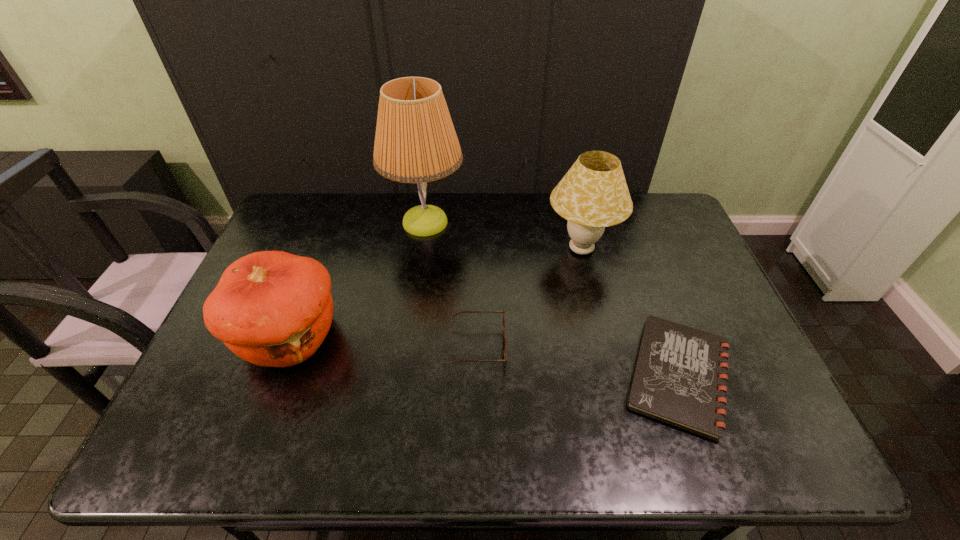
The height and width of the screenshot is (540, 960). In the image, there is a desktop. Identify the location of free space at the near left corner. (196, 453).

Image resolution: width=960 pixels, height=540 pixels. In the image, there is a desktop. What are the coordinates of `vacant space at the far right corner` in the screenshot? It's located at (635, 214).

Where is `free region at the near right corner`? free region at the near right corner is located at coordinates (730, 448).

Image resolution: width=960 pixels, height=540 pixels. Identify the location of vacant area that lies between the spectacles and the tallest object. (452, 285).

At what (x,y) coordinates should I click in order to perform the action: click on free space between the lampshade and the spectacles. Please return your answer as a coordinate pair (x, y). This screenshot has width=960, height=540. Looking at the image, I should click on (530, 298).

This screenshot has height=540, width=960. I want to click on free area in between the second tallest object and the leftmost object, so click(436, 293).

Find the location of a particular element. This screenshot has width=960, height=540. vacant area that lies between the second tallest object and the leftmost object is located at coordinates (436, 293).

Locate an element on the screen. This screenshot has height=540, width=960. free space between the third shortest object and the shortest object is located at coordinates (485, 356).

Identify the location of unoccupied position between the tallest object and the pumpkin. The image size is (960, 540). (358, 280).

Where is `vacant region between the shortest object and the second tallest object`? vacant region between the shortest object and the second tallest object is located at coordinates (630, 313).